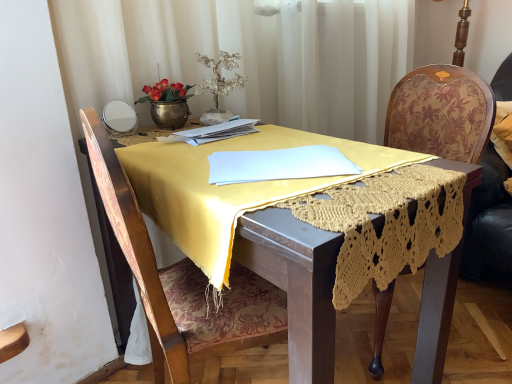
At what (x,y) coordinates should I click in order to perform the action: click on vacant area to the left of white paper at center. Please return your answer as a coordinate pair (x, y). The width and height of the screenshot is (512, 384). Looking at the image, I should click on (142, 143).